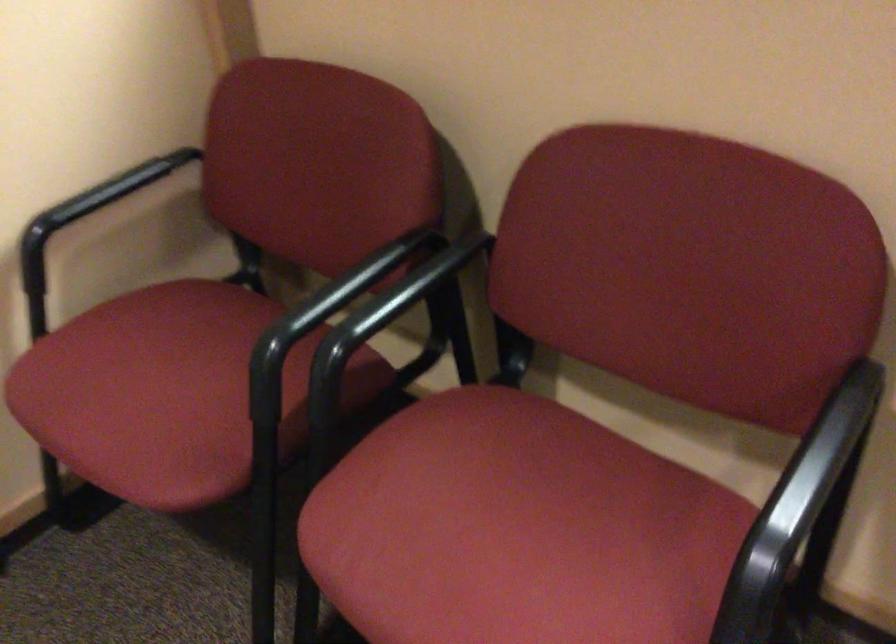
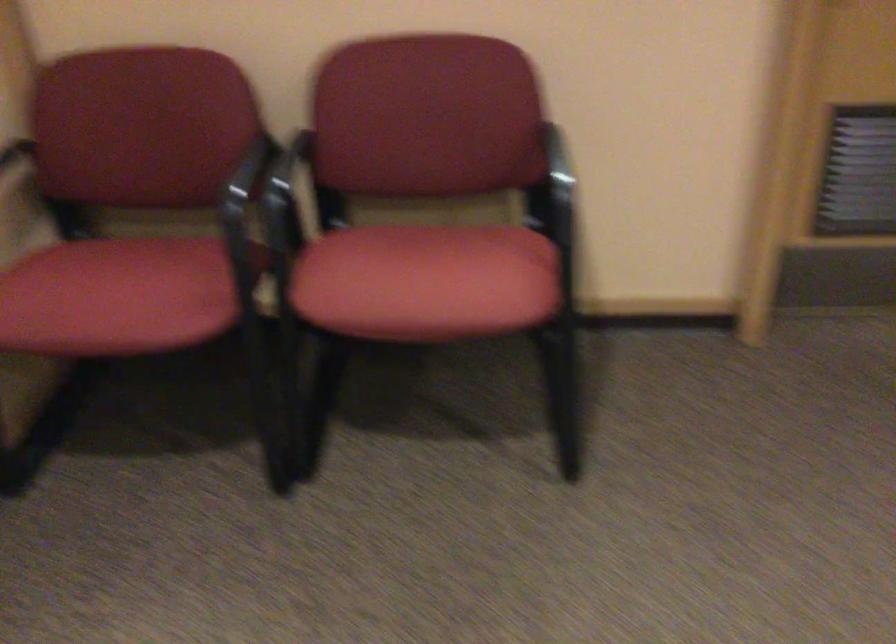
The point at (265, 357) is marked in the first image. Where is the corresponding point in the second image?

(244, 212)